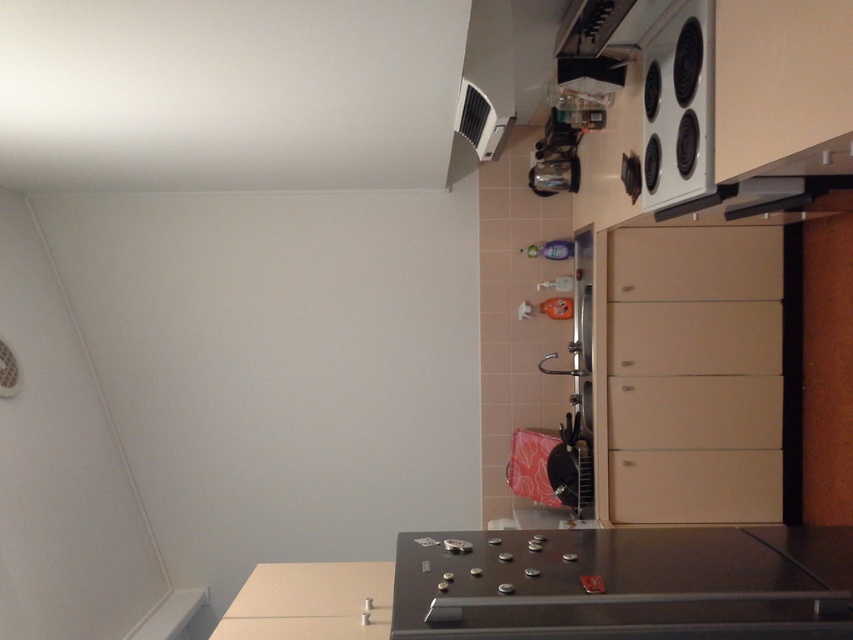
Does point (432, 550) come in front of point (689, 77)?

No, it is not.

What are the coordinates of `black matte countertop at lower center` in the screenshot? It's located at (566, 588).